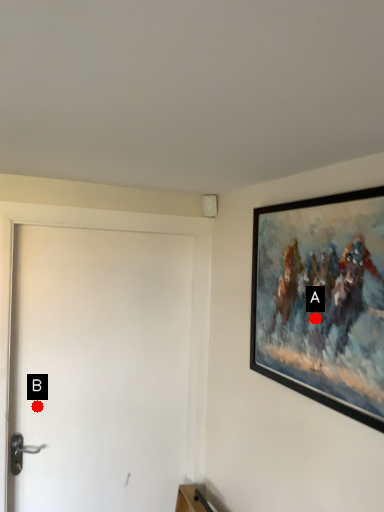
Question: Two points are circled on the image, labeled by A and B beside each circle. Which of the following is the closest to the observer?

Choices:
 (A) A is closer
 (B) B is closer

Answer: (A)